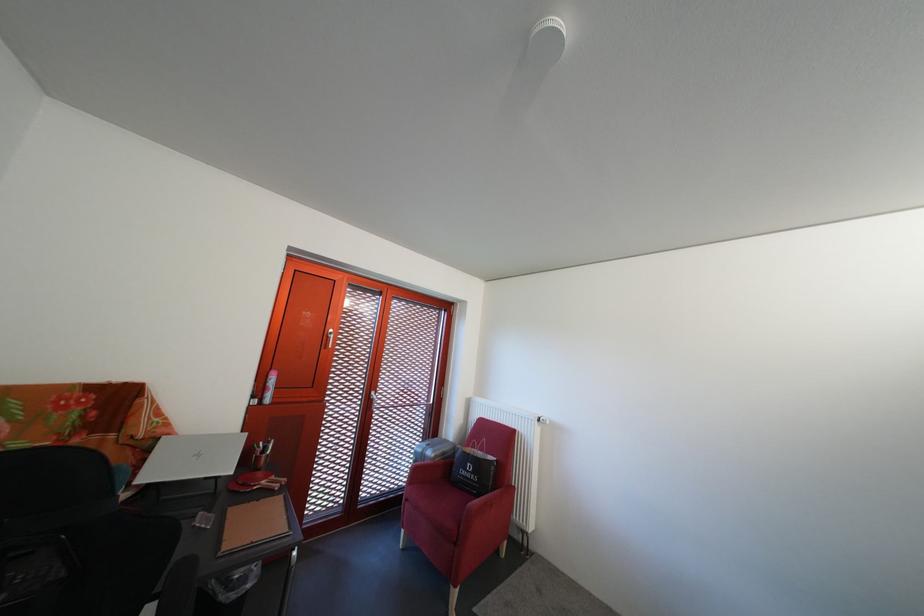
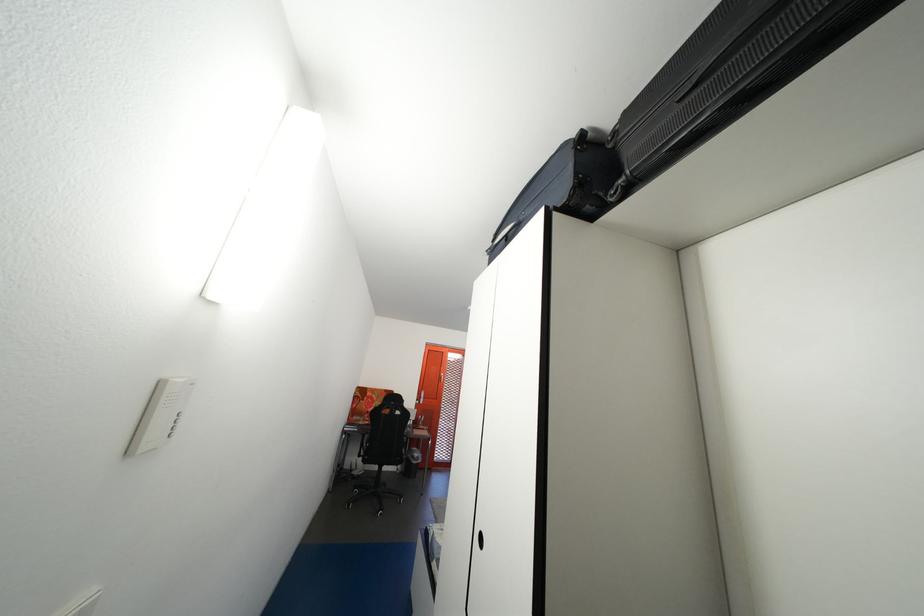
Question: I am providing you with two images of the same scene from different viewpoints. Which of the following objects are not visible in image2?

Choices:
 (A) chair sitting surface
 (B) white panel button
 (C) binding machine lid
 (D) black chair armrest

Answer: (A)